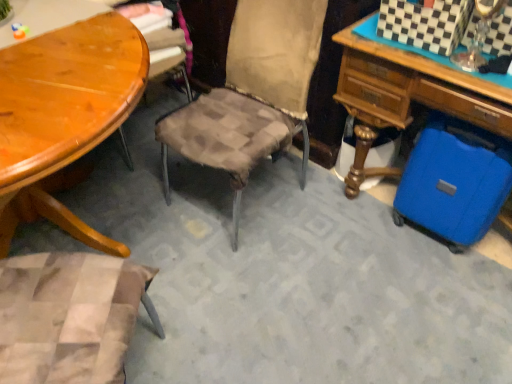
Question: Is blue hardshell suitcase at lower right next to shiny wood table at left and touching it?

Choices:
 (A) yes
 (B) no

Answer: (B)

Question: Considering the relative sizes of blue hardshell suitcase at lower right and shiny wood table at left in the image provided, is blue hardshell suitcase at lower right thinner than shiny wood table at left?

Choices:
 (A) no
 (B) yes

Answer: (B)

Question: From the image's perspective, is blue hardshell suitcase at lower right under shiny wood table at left?

Choices:
 (A) no
 (B) yes

Answer: (A)

Question: Could you tell me if blue hardshell suitcase at lower right is turned towards shiny wood table at left?

Choices:
 (A) yes
 (B) no

Answer: (B)

Question: Is blue hardshell suitcase at lower right bigger than shiny wood table at left?

Choices:
 (A) no
 (B) yes

Answer: (A)

Question: Is blue hardshell suitcase at lower right in front of or behind blue hard plastic suitcase at lower right in the image?

Choices:
 (A) behind
 (B) front

Answer: (A)

Question: From a real-world perspective, relative to blue hard plastic suitcase at lower right, is blue hardshell suitcase at lower right vertically above or below?

Choices:
 (A) below
 (B) above

Answer: (A)

Question: Considering the positions of point pyautogui.click(x=457, y=125) and point pyautogui.click(x=340, y=72), is point pyautogui.click(x=457, y=125) closer or farther from the camera than point pyautogui.click(x=340, y=72)?

Choices:
 (A) farther
 (B) closer

Answer: (B)

Question: Would you say blue hardshell suitcase at lower right is to the left or to the right of blue hard plastic suitcase at lower right in the picture?

Choices:
 (A) left
 (B) right

Answer: (A)

Question: Considering their positions, is blue hardshell suitcase at lower right located in front of or behind shiny wood table at left?

Choices:
 (A) behind
 (B) front

Answer: (A)

Question: In terms of size, does blue hardshell suitcase at lower right appear bigger or smaller than shiny wood table at left?

Choices:
 (A) small
 (B) big

Answer: (A)

Question: From a real-world perspective, is blue hardshell suitcase at lower right positioned above or below shiny wood table at left?

Choices:
 (A) below
 (B) above

Answer: (A)

Question: Looking at their shapes, would you say blue hardshell suitcase at lower right is wider or thinner than shiny wood table at left?

Choices:
 (A) wide
 (B) thin

Answer: (B)

Question: Is shiny wood table at left to the left or to the right of blue hardshell suitcase at lower right in the image?

Choices:
 (A) right
 (B) left

Answer: (B)

Question: In terms of size, does shiny wood table at left appear bigger or smaller than blue hardshell suitcase at lower right?

Choices:
 (A) big
 (B) small

Answer: (A)